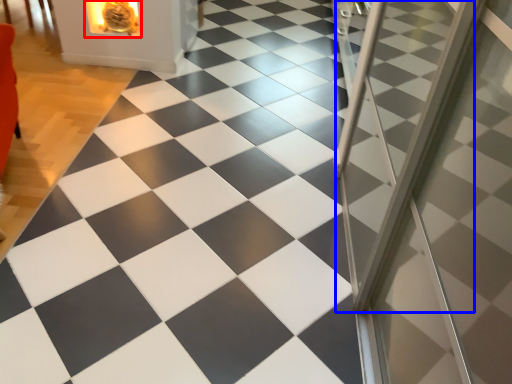
Question: Which object appears closest to the camera in this image, fireplace (highlighted by a red box) or screen door (highlighted by a blue box)?

Choices:
 (A) fireplace
 (B) screen door

Answer: (B)